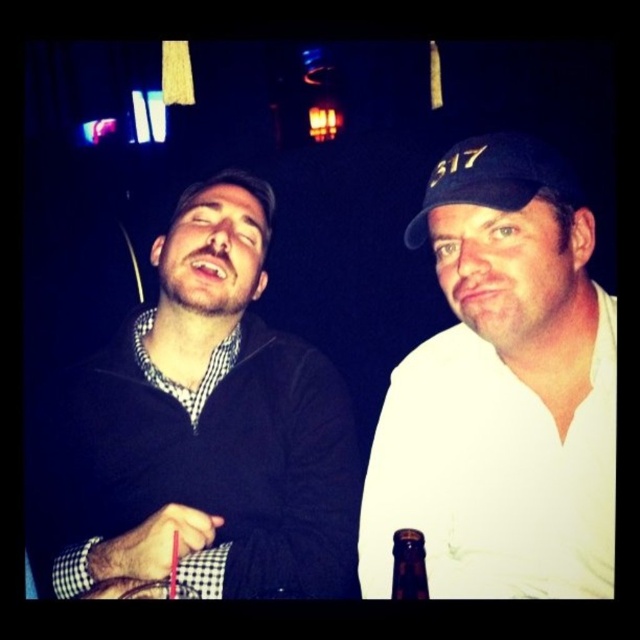
Does black matte sweater at center have a larger size compared to brown glass bottle at lower center?

Indeed, black matte sweater at center has a larger size compared to brown glass bottle at lower center.

Between point (237, 541) and point (401, 547), which one is positioned behind?

Positioned behind is point (237, 541).

Identify the location of black matte sweater at center. (202, 432).

Who is taller, black matte sweater at center or white matte cap at upper right?

black matte sweater at center is taller.

Can you confirm if black matte sweater at center is positioned above white matte cap at upper right?

Yes, black matte sweater at center is above white matte cap at upper right.

Is point (60, 557) closer to viewer compared to point (506, 237)?

That is False.

This screenshot has height=640, width=640. I want to click on black matte sweater at center, so click(202, 432).

Which is behind, point (552, 161) or point (403, 595)?

The point (552, 161) is behind.

This screenshot has height=640, width=640. Describe the element at coordinates (497, 179) in the screenshot. I see `black fabric cap at upper right` at that location.

Where is `black fabric cap at upper right`? The width and height of the screenshot is (640, 640). black fabric cap at upper right is located at coordinates (497, 179).